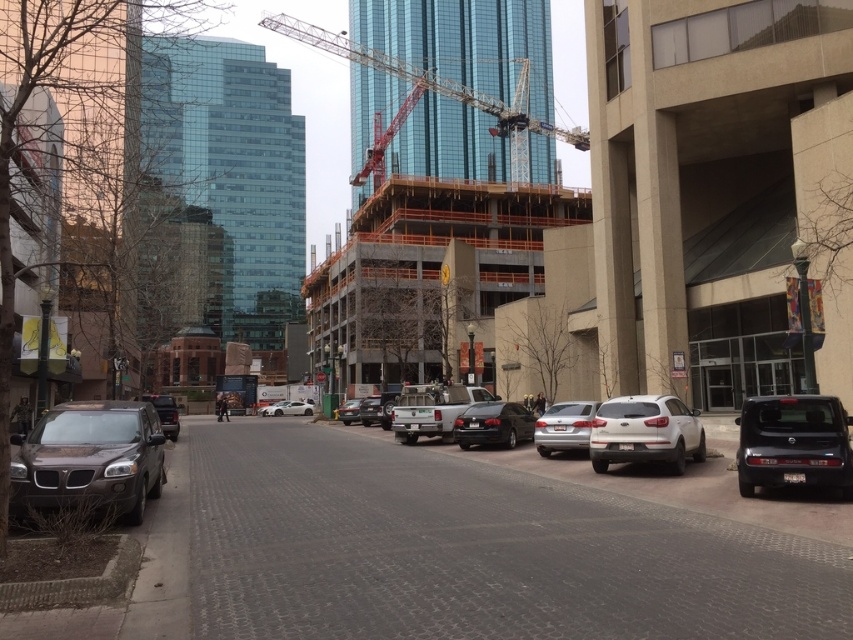
Question: Does satin silver sedan at center appear over matte black car at left?

Choices:
 (A) yes
 (B) no

Answer: (A)

Question: Estimate the real-world distances between objects in this image. Which object is closer to the matte black car at left?

Choices:
 (A) satin silver sedan at center
 (B) shiny black sedan at center

Answer: (B)

Question: Where is white matte truck at center located in relation to matte black truck at center in the image?

Choices:
 (A) above
 (B) below

Answer: (A)

Question: Can you confirm if orange metallic crane at center is positioned above white matte truck at center?

Choices:
 (A) no
 (B) yes

Answer: (B)

Question: Which point is closer to the camera?

Choices:
 (A) orange metallic crane at center
 (B) white matte truck at center
 (C) black matte suv at lower right

Answer: (C)

Question: Which point appears closest to the camera in this image?

Choices:
 (A) (352, 400)
 (B) (511, 442)

Answer: (B)